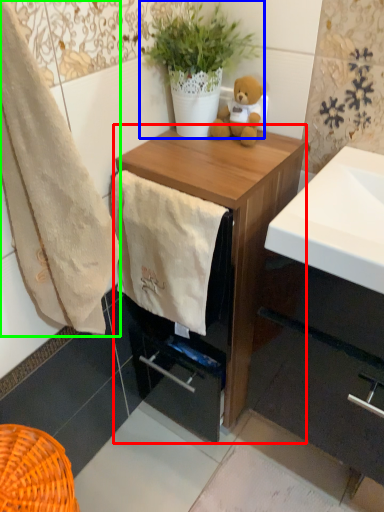
Question: Which object is the farthest from chest of drawers (highlighted by a red box)? Choose among these: houseplant (highlighted by a blue box) or towel/napkin (highlighted by a green box).

Choices:
 (A) houseplant
 (B) towel/napkin

Answer: (B)